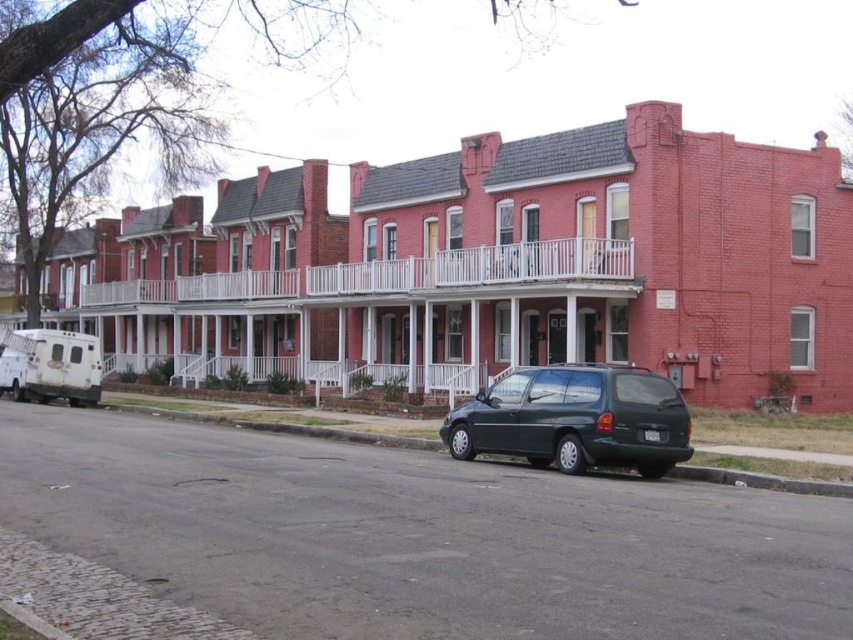
Is green matte minivan at center bigger than white matte van at left?

Incorrect, green matte minivan at center is not larger than white matte van at left.

Which of these two, green matte minivan at center or white matte van at left, stands shorter?

green matte minivan at center

Which is behind, point (531, 432) or point (88, 400)?

Positioned behind is point (88, 400).

Image resolution: width=853 pixels, height=640 pixels. What are the coordinates of `green matte minivan at center` in the screenshot? It's located at (575, 419).

Can you confirm if green matte minivan at center is shorter than dark gray asphalt at lower center?

No.

Who is more distant from viewer, (466, 436) or (291, 433)?

Point (291, 433)

Identify the location of green matte minivan at center. This screenshot has width=853, height=640. (575, 419).

Which is more to the right, white matte van at left or dark gray asphalt at lower center?

From the viewer's perspective, dark gray asphalt at lower center appears more on the right side.

Identify the location of white matte van at left. (51, 365).